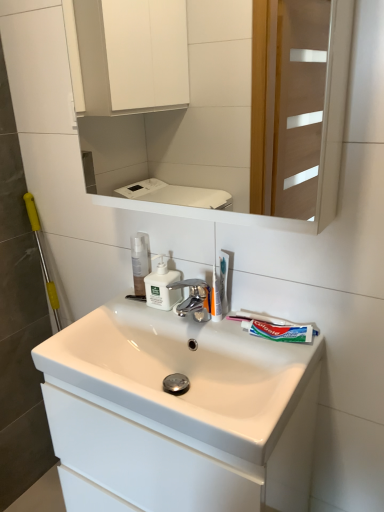
The width and height of the screenshot is (384, 512). Find the location of `vacant space positioned to the left of translucent plastic toothbrush at upper center`. vacant space positioned to the left of translucent plastic toothbrush at upper center is located at coordinates (174, 317).